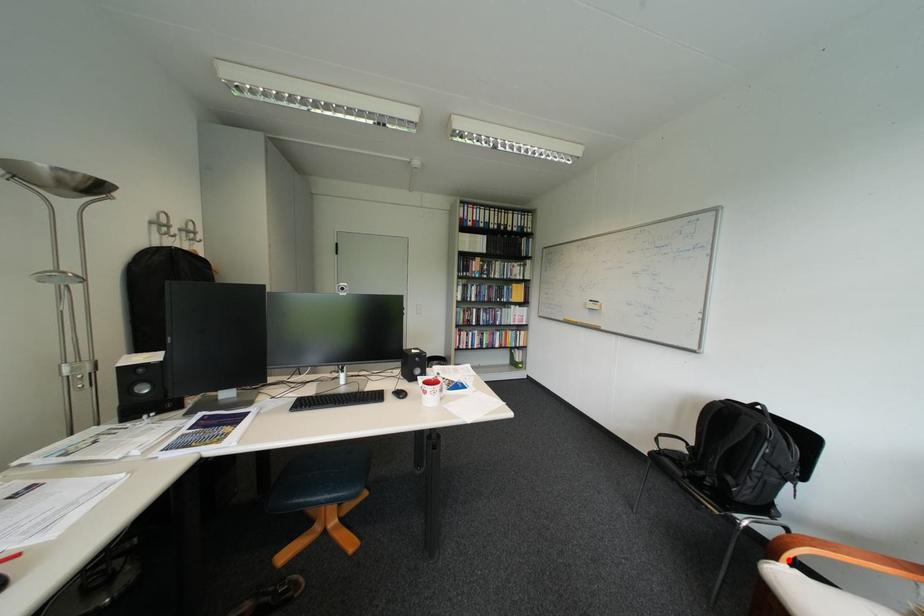
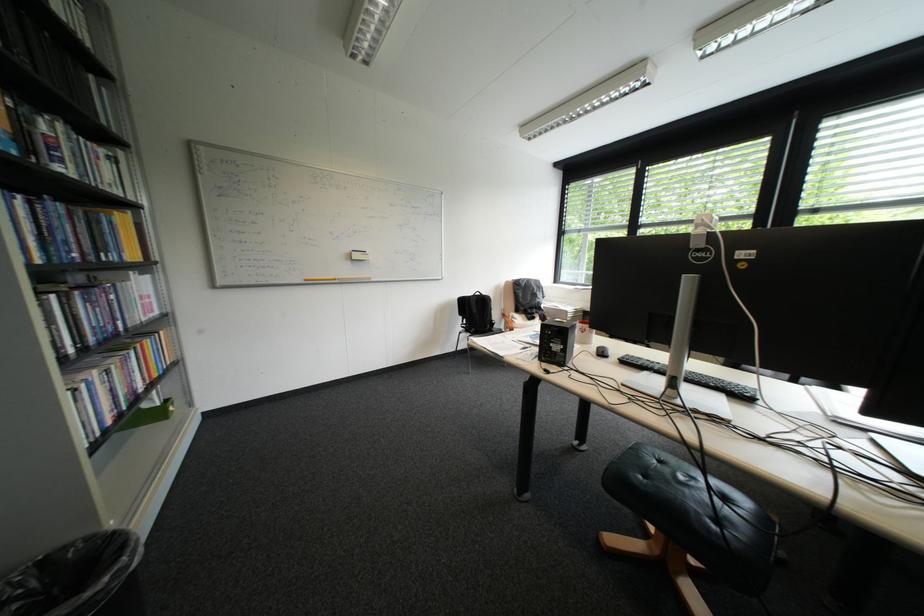
Question: I am providing you with two images of the same scene from different viewpoints. A red point is marked on the first image. Is the red point's position out of view in image 2?

Choices:
 (A) Yes
 (B) No

Answer: (A)